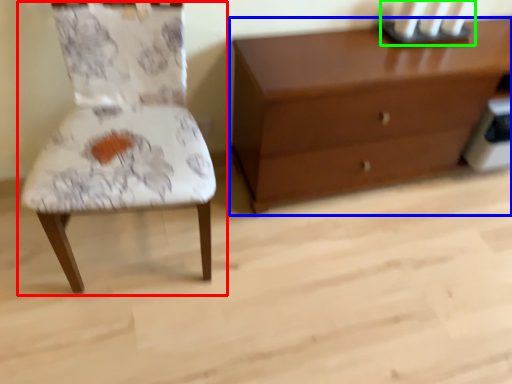
Question: Which is farther away from chair (highlighted by a red box)? chest of drawers (highlighted by a blue box) or candle holder (highlighted by a green box)?

Choices:
 (A) chest of drawers
 (B) candle holder

Answer: (B)